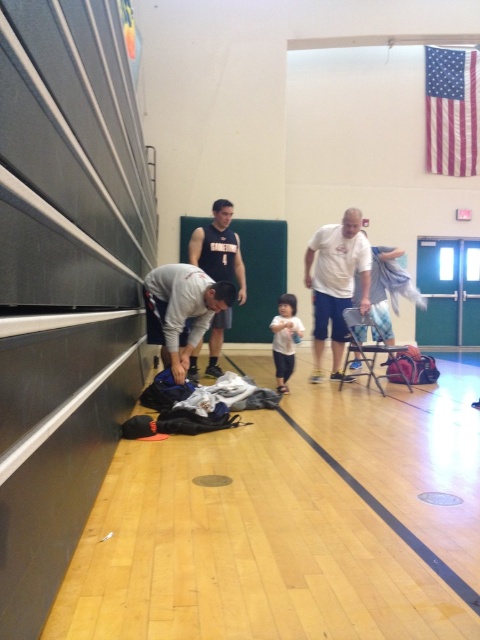
You are a photographer setting up a shoot in this gymnasium. You have a white matte shirt at center and a metallic silver folding chair at center in your frame. Which object should you adjust to ensure both are fully visible in the photo? Explain your reasoning.

The white matte shirt at center is taller than the metallic silver folding chair at center. To ensure both are fully visible in the photo, you should adjust the angle or focus so that the taller white matte shirt at center doesn not block the view of the shorter metallic silver folding chair at center.

You are a gym instructor organizing equipment. You see the white matte shirt at center and the black jersey at center. How far apart are they?

The white matte shirt at center and the black jersey at center are 38.75 inches apart from each other.